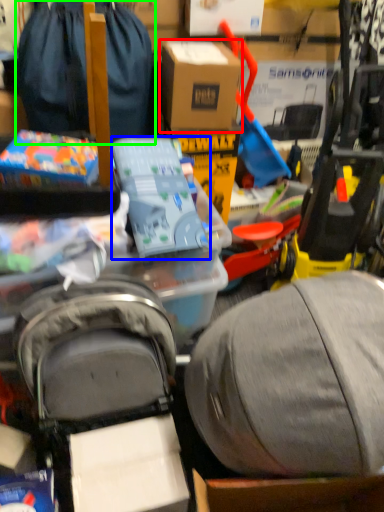
Question: Estimate the real-world distances between objects in this image. Which object is closer to box (highlighted by a red box), toy (highlighted by a blue box) or luggage and bags (highlighted by a green box)?

Choices:
 (A) toy
 (B) luggage and bags

Answer: (B)